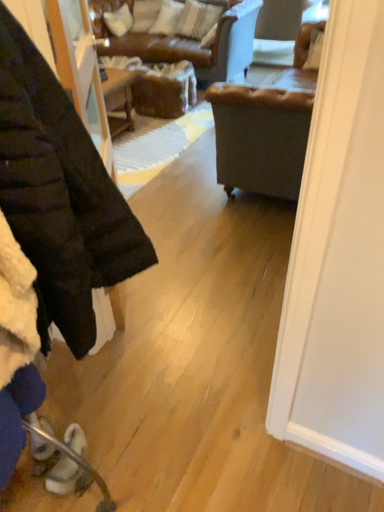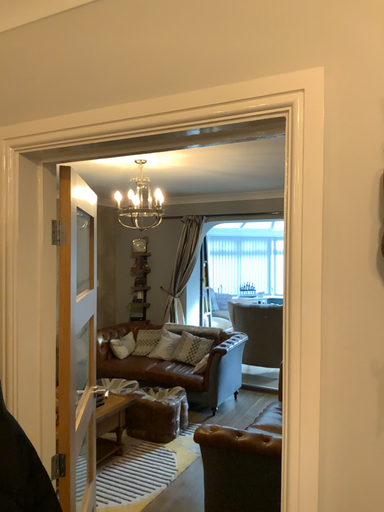
Question: Which way did the camera rotate in the video?

Choices:
 (A) rotated upward
 (B) rotated downward

Answer: (A)